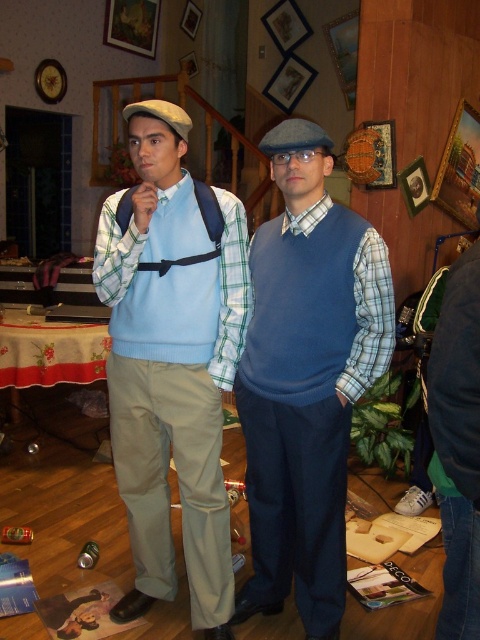
Question: Which point is closer to the camera?

Choices:
 (A) matte blue fabric suspenders at center
 (B) blue wool sweater vest at center

Answer: (B)

Question: Which of the following is the farthest from the observer?

Choices:
 (A) (385, 324)
 (B) (139, 464)

Answer: (B)

Question: Does matte blue fabric suspenders at center come in front of blue wool sweater vest at center?

Choices:
 (A) yes
 (B) no

Answer: (B)

Question: Can you confirm if matte blue fabric suspenders at center is thinner than blue wool sweater vest at center?

Choices:
 (A) yes
 (B) no

Answer: (B)

Question: Can you confirm if matte blue fabric suspenders at center is wider than blue wool sweater vest at center?

Choices:
 (A) yes
 (B) no

Answer: (A)

Question: Among these points, which one is farthest from the camera?

Choices:
 (A) (342, 241)
 (B) (181, 145)

Answer: (B)